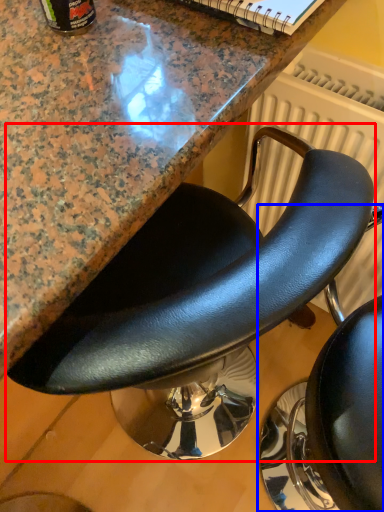
Question: Which of the following is the closest to the observer, chair (highlighted by a red box) or chair (highlighted by a blue box)?

Choices:
 (A) chair
 (B) chair

Answer: (B)